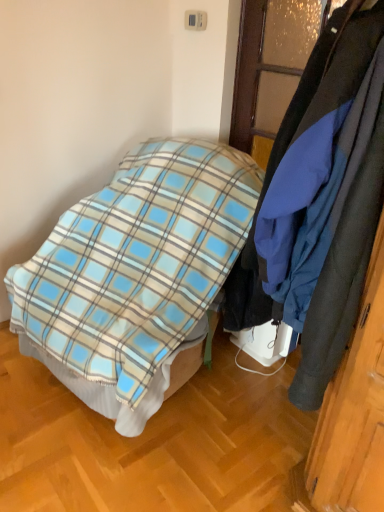
The height and width of the screenshot is (512, 384). What do you see at coordinates (319, 201) in the screenshot? I see `dark blue fabric coat at right` at bounding box center [319, 201].

This screenshot has width=384, height=512. I want to click on dark blue fabric coat at right, so click(319, 201).

I want to click on blue plaid blanket at center, so click(x=135, y=274).

Describe the element at coordinates (135, 274) in the screenshot. This screenshot has height=512, width=384. I see `blue plaid blanket at center` at that location.

Identify the location of dark blue fabric coat at right. This screenshot has height=512, width=384. (319, 201).

Can you confirm if dark blue fabric coat at right is positioned to the left of blue plaid blanket at center?

No.

Relative to blue plaid blanket at center, is dark blue fabric coat at right in front or behind?

In the image, dark blue fabric coat at right appears in front of blue plaid blanket at center.

Is point (285, 233) closer or farther from the camera than point (93, 280)?

Point (285, 233) is positioned closer to the camera compared to point (93, 280).

From the image's perspective, is dark blue fabric coat at right located beneath blue plaid blanket at center?

No, from the image's perspective, dark blue fabric coat at right is not beneath blue plaid blanket at center.

From a real-world perspective, is dark blue fabric coat at right positioned under blue plaid blanket at center based on gravity?

Actually, dark blue fabric coat at right is physically above blue plaid blanket at center in the real world.

Which object is thinner, dark blue fabric coat at right or blue plaid blanket at center?

Thinner between the two is dark blue fabric coat at right.

In terms of height, does dark blue fabric coat at right look taller or shorter compared to blue plaid blanket at center?

Clearly, dark blue fabric coat at right is shorter compared to blue plaid blanket at center.

Is dark blue fabric coat at right bigger or smaller than blue plaid blanket at center?

Clearly, dark blue fabric coat at right is smaller in size than blue plaid blanket at center.

Is dark blue fabric coat at right inside the boundaries of blue plaid blanket at center, or outside?

The correct answer is: outside.

Are dark blue fabric coat at right and blue plaid blanket at center making contact?

dark blue fabric coat at right and blue plaid blanket at center are clearly separated.

Based on the photo, is dark blue fabric coat at right facing away from blue plaid blanket at center?

That's not correct — dark blue fabric coat at right is not looking away from blue plaid blanket at center.

How many degrees apart are the facing directions of dark blue fabric coat at right and blue plaid blanket at center?

They differ by 2.51 degrees in their facing directions.

Locate an element on the screen. This screenshot has width=384, height=512. bed located on the left of dark blue fabric coat at right is located at coordinates (135, 274).

Can you confirm if blue plaid blanket at center is positioned to the left of dark blue fabric coat at right?

Yes, blue plaid blanket at center is to the left of dark blue fabric coat at right.

Which object is more forward, blue plaid blanket at center or dark blue fabric coat at right?

Positioned in front is dark blue fabric coat at right.

Considering the positions of point (237, 157) and point (291, 125), is point (237, 157) closer or farther from the camera than point (291, 125)?

Point (237, 157).

From the image's perspective, is blue plaid blanket at center located beneath dark blue fabric coat at right?

Yes, from the image's perspective, blue plaid blanket at center is below dark blue fabric coat at right.

From a real-world perspective, which is physically below, blue plaid blanket at center or dark blue fabric coat at right?

In real-world perspective, blue plaid blanket at center is lower.

From the picture: Between blue plaid blanket at center and dark blue fabric coat at right, which one has smaller width?

dark blue fabric coat at right.

Is blue plaid blanket at center shorter than dark blue fabric coat at right?

No, blue plaid blanket at center is not shorter than dark blue fabric coat at right.

Who is smaller, blue plaid blanket at center or dark blue fabric coat at right?

With smaller size is dark blue fabric coat at right.

Is blue plaid blanket at center situated inside dark blue fabric coat at right or outside?

The correct answer is: outside.

Is blue plaid blanket at center not near dark blue fabric coat at right?

They are positioned close to each other.

Is blue plaid blanket at center facing away from dark blue fabric coat at right?

That's not correct — blue plaid blanket at center is not looking away from dark blue fabric coat at right.

Can you tell me how much blue plaid blanket at center and dark blue fabric coat at right differ in facing direction?

They differ by 2.51 degrees in their facing directions.

How much distance is there between blue plaid blanket at center and dark blue fabric coat at right?

blue plaid blanket at center and dark blue fabric coat at right are 19.75 inches apart.

You are a GUI agent. You are given a task and a screenshot of the screen. Output one action in this format:
    pyautogui.click(x=<x>, y=<y>)
    Task: Click on the bed on the left of dark blue fabric coat at right
    
    Given the screenshot: What is the action you would take?
    pyautogui.click(x=135, y=274)

Find the location of `bed on the left side of dark blue fabric coat at right`. bed on the left side of dark blue fabric coat at right is located at coordinates (135, 274).

This screenshot has height=512, width=384. I want to click on bed directly beneath the dark blue fabric coat at right (from a real-world perspective), so click(135, 274).